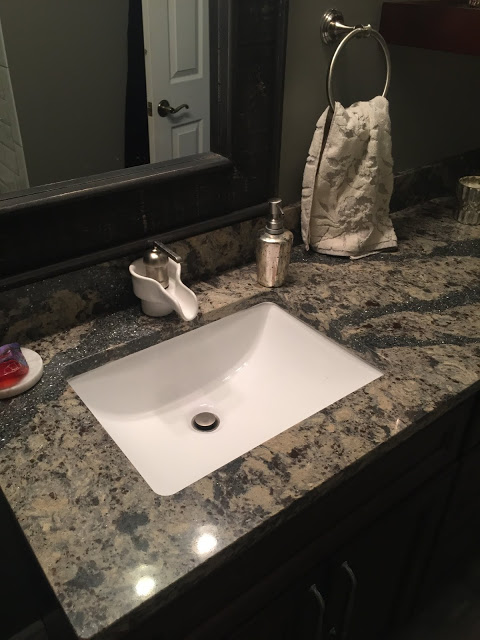
Identify the location of faucet handle. (167, 249).